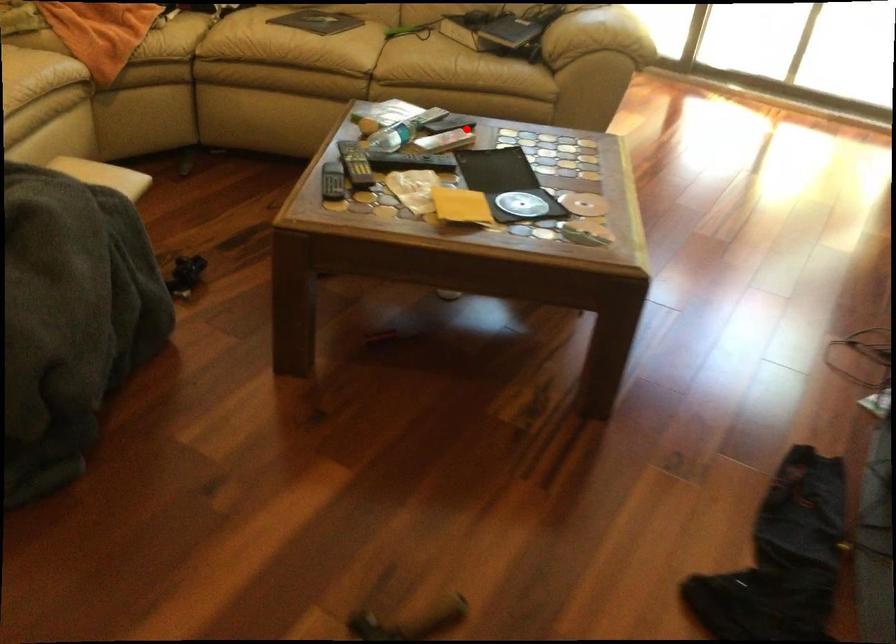
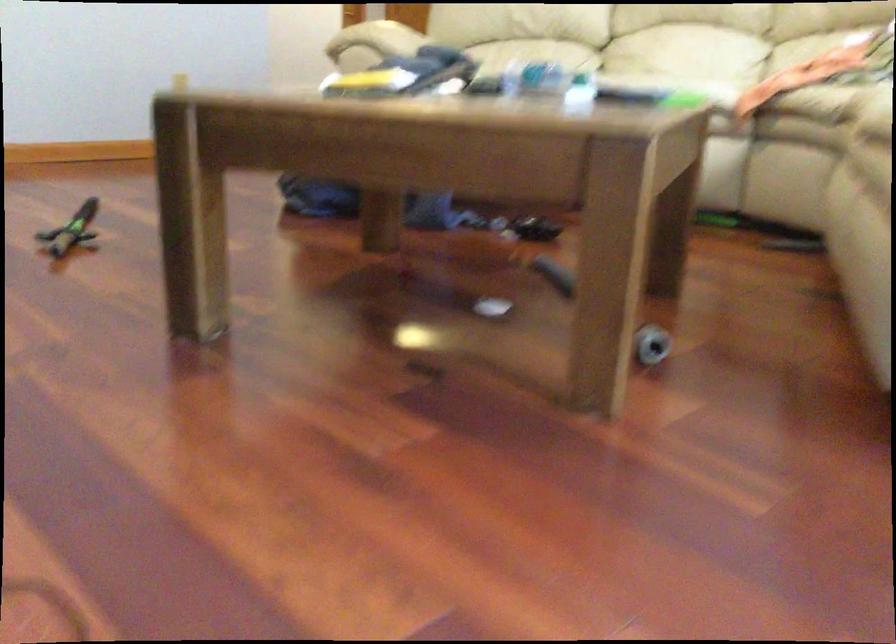
The point at the highlighted location is marked in the first image. Where is the corresponding point in the second image?

(580, 93)